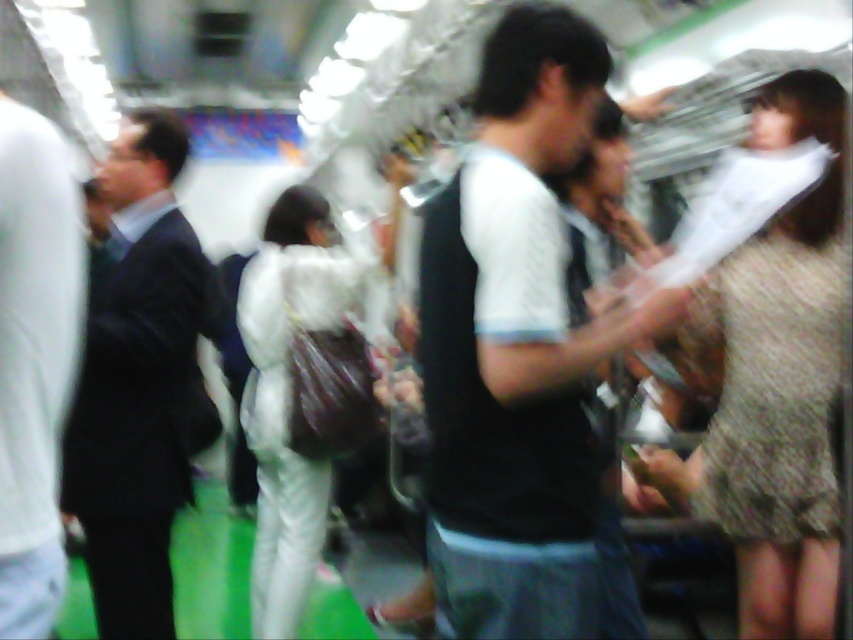
You are a security guard at this station and need to ensure there is enough space between people for safety. The minimum required distance is 36 inches. Are the dark suit at left and dark gray suit at left meeting the safety distance requirement?

The dark suit at left is 34.04 inches from dark gray suit at left, which is less than the required 36 inches. Therefore, they are not meeting the safety distance requirement.

You are a photographer trying to capture a candid shot of both the dark gray suit at left and the white matte suit at center in the same frame. Given their sizes, which person should you focus on first to ensure both are in the frame?

The dark gray suit at left is smaller in size compared to the white matte suit at center. To include both in the frame, focus on the white matte suit at center first as it is larger and will be easier to frame, then adjust to include the smaller dark gray suit at left.